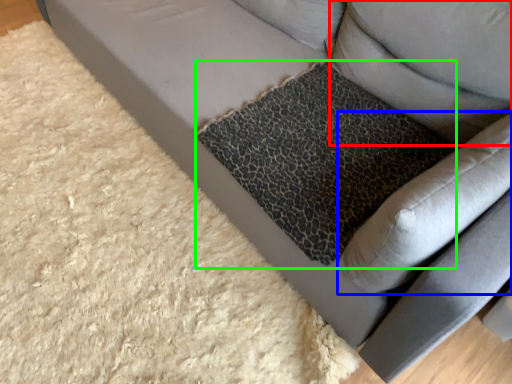
Question: Based on their relative distances, which object is farther from pillow (highlighted by a red box)? Choose from swivel chair (highlighted by a blue box) and cat bed (highlighted by a green box).

Choices:
 (A) swivel chair
 (B) cat bed

Answer: (A)